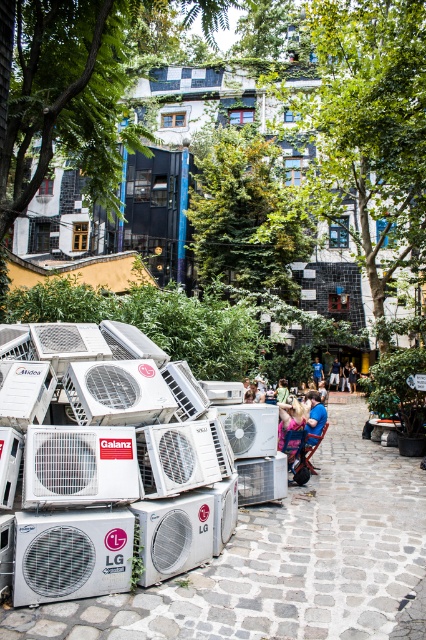
You are a delivery person who needs to place a new air conditioner next to the silver metallic lg air conditioner at lower left without blocking the dark blue shirt at center. Can you fit it there based on their sizes?

The silver metallic lg air conditioner at lower left is smaller than the dark blue shirt at center. Since the new air conditioner would likely be similar in size to the existing one, there might be enough space next to it without blocking the dark blue shirt at center, but this depends on the exact dimensions of the new unit.

You are standing at the point marked with coordinates (244, 212) in the image. What object is exactly at this location?

The green leafy tree at center is located at point (244, 212).

You are a delivery person trying to navigate through the cobblestone pathway. You see the green leafy tree at center and the silver metallic air conditioner at center. Which object is wider?

The green leafy tree at center is wider than the silver metallic air conditioner at center according to the description.